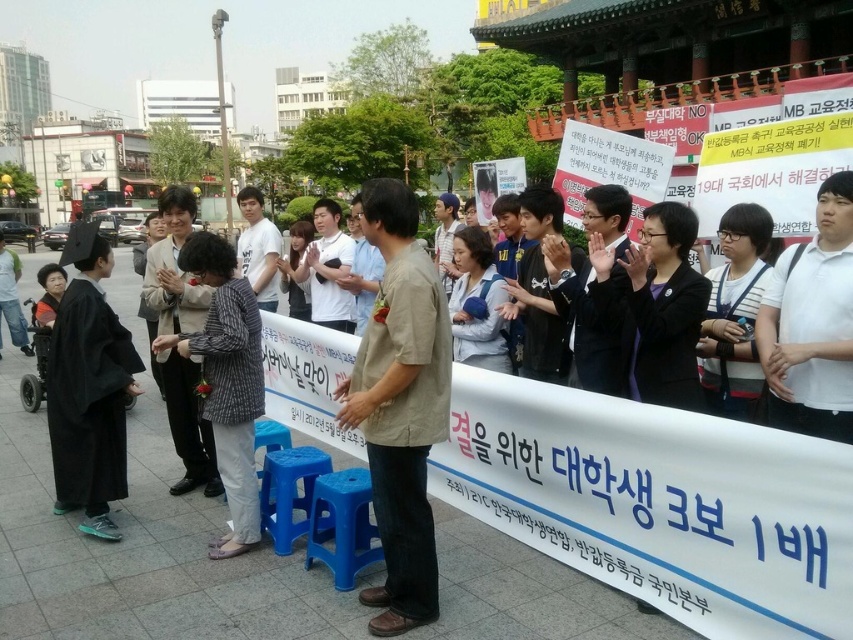
Question: Does black matte graduation gown at left have a lesser width compared to plaid fabric jacket at center?

Choices:
 (A) yes
 (B) no

Answer: (B)

Question: Which of the following is the closest to the observer?

Choices:
 (A) (364, 225)
 (B) (177, 273)

Answer: (A)

Question: Based on their relative distances, which object is nearer to the black matte graduation gown at left?

Choices:
 (A) khaki cotton shirt at center
 (B) striped fabric shirt at center
 (C) white cotton shirt at center

Answer: (B)

Question: Which of the following is the farthest from the observer?

Choices:
 (A) white cotton shirt at center
 (B) black matte graduation gown at left

Answer: (B)

Question: Is plaid fabric jacket at center above striped fabric shirt at center?

Choices:
 (A) no
 (B) yes

Answer: (A)

Question: Is black matte graduation gown at left above white cotton shirt at center?

Choices:
 (A) no
 (B) yes

Answer: (A)